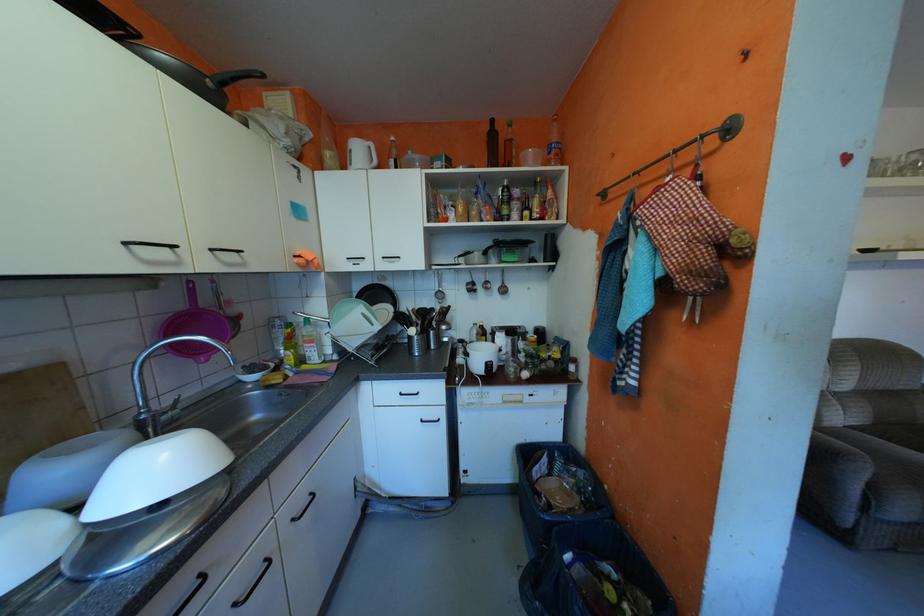
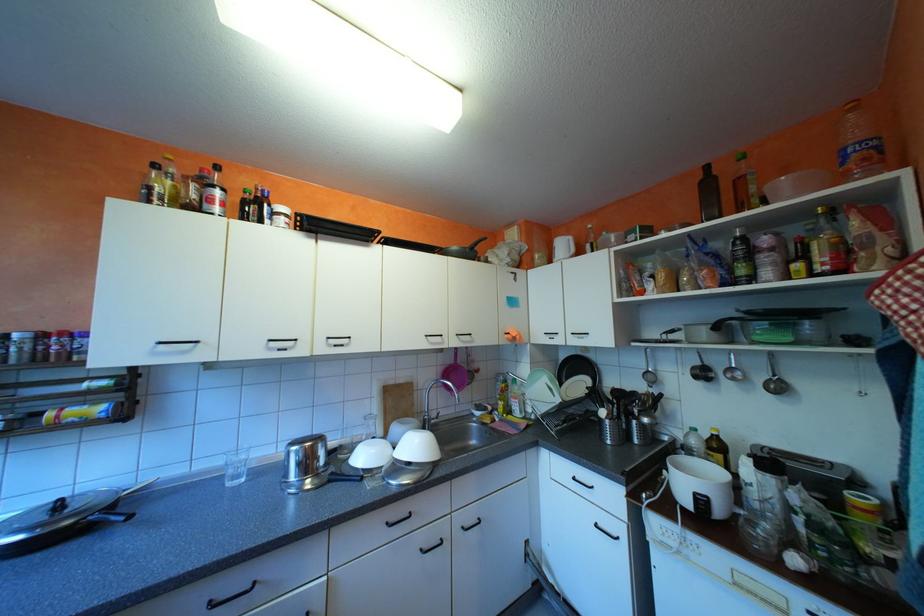
The point at (568,153) is marked in the first image. Where is the corresponding point in the second image?

(877, 159)